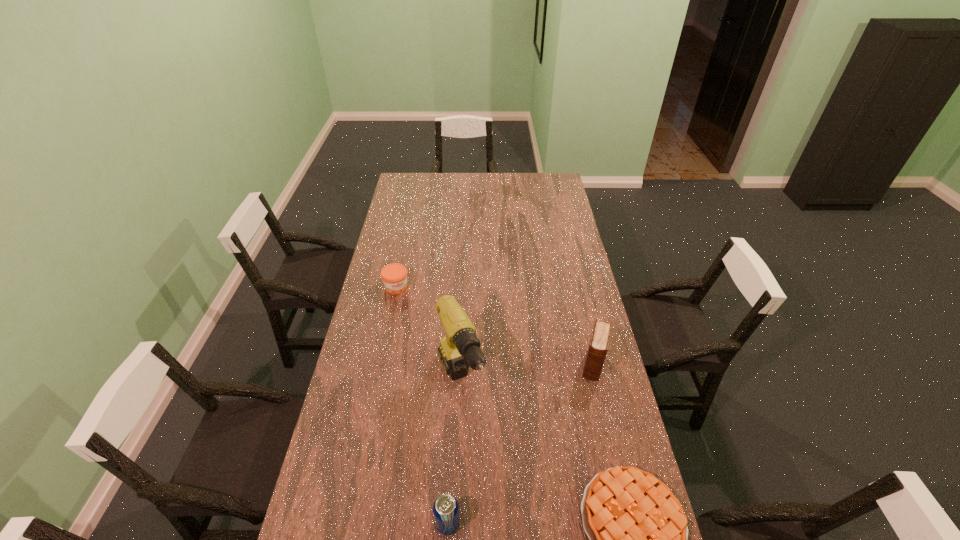
At what (x,y) coordinates should I click in order to perform the action: click on the third tallest object. Please return your answer as a coordinate pair (x, y). The height and width of the screenshot is (540, 960). Looking at the image, I should click on (445, 508).

Find the location of `the leftmost object`. the leftmost object is located at coordinates coord(394,276).

This screenshot has width=960, height=540. I want to click on the second shortest object, so click(394, 276).

Where is `the second tallest object`? the second tallest object is located at coordinates (599, 342).

What are the coordinates of `the tallest object` in the screenshot? It's located at (460, 349).

The width and height of the screenshot is (960, 540). In order to click on vacant space located 0.200m on the back of the third tallest object in this screenshot , I will do `click(452, 441)`.

Locate an element on the screen. The width and height of the screenshot is (960, 540). free space located on the front label of the second shortest object is located at coordinates (422, 335).

At what (x,y) coordinates should I click in order to perform the action: click on vacant position located on the front label of the second shortest object. Please return your answer as a coordinate pair (x, y). Image resolution: width=960 pixels, height=540 pixels. Looking at the image, I should click on (437, 362).

Find the location of `vacant space situated 0.060m on the front label of the second shortest object`. vacant space situated 0.060m on the front label of the second shortest object is located at coordinates (406, 305).

Identify the location of vacant position located 0.070m on the spine side of the fourth shortest object. (589, 398).